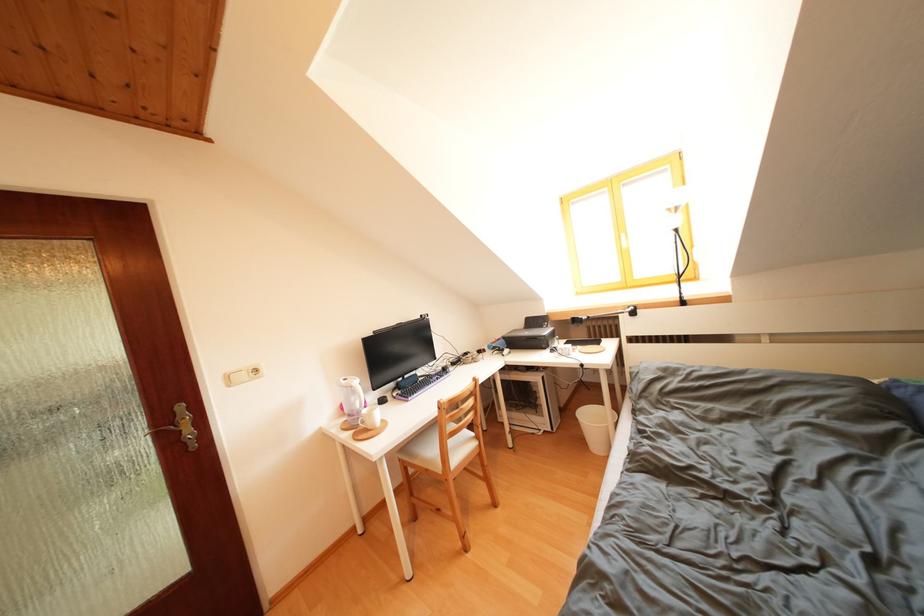
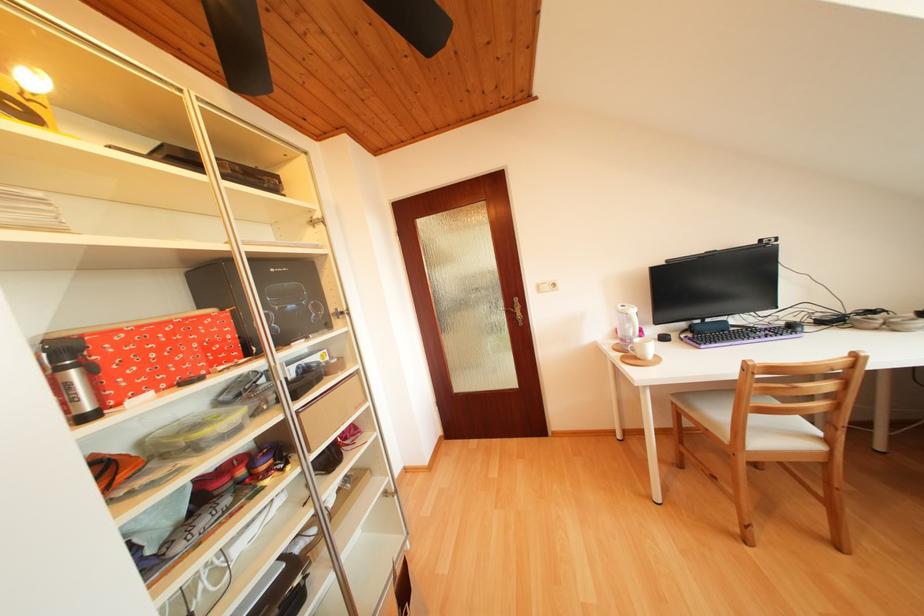
Where in the second image is the point corresponding to point 379,419 from the first image?

(650, 350)